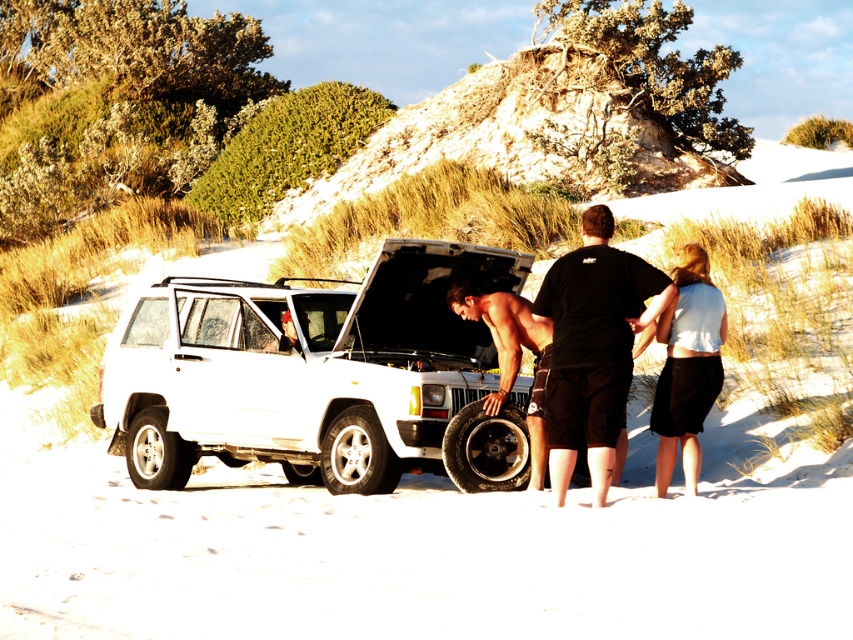
Question: Which point is farther to the camera?

Choices:
 (A) (247, 285)
 (B) (668, 419)

Answer: (A)

Question: Does white matte suv at center have a greater width compared to white matte skirt at lower right?

Choices:
 (A) yes
 (B) no

Answer: (A)

Question: Which point is farther to the camera?

Choices:
 (A) (346, 369)
 (B) (608, 422)

Answer: (A)

Question: Does black matte shirt at center appear on the right side of white matte skirt at lower right?

Choices:
 (A) yes
 (B) no

Answer: (B)

Question: Estimate the real-world distances between objects in this image. Which object is farther from the white matte skirt at lower right?

Choices:
 (A) black matte shirt at center
 (B) white matte suv at center

Answer: (B)

Question: Can you confirm if white matte suv at center is positioned above black matte shirt at center?

Choices:
 (A) no
 (B) yes

Answer: (A)